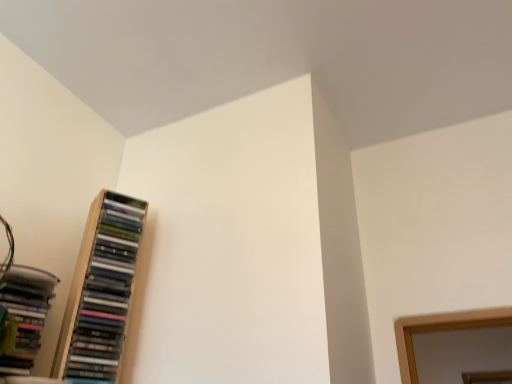
Question: Is wooden bookcase at left to the left or to the right of matte black books at left in the image?

Choices:
 (A) right
 (B) left

Answer: (A)

Question: Considering the positions of wooden bookcase at left and matte black books at left in the image, is wooden bookcase at left wider or thinner than matte black books at left?

Choices:
 (A) thin
 (B) wide

Answer: (A)

Question: Relative to matte black books at left, is wooden bookcase at left in front or behind?

Choices:
 (A) front
 (B) behind

Answer: (B)

Question: Is matte black books at left bigger or smaller than wooden bookcase at left?

Choices:
 (A) small
 (B) big

Answer: (A)

Question: Which is correct: matte black books at left is inside wooden bookcase at left, or outside of it?

Choices:
 (A) inside
 (B) outside

Answer: (B)

Question: From the image's perspective, is matte black books at left above or below wooden bookcase at left?

Choices:
 (A) above
 (B) below

Answer: (B)

Question: Based on their positions, is matte black books at left located to the left or right of wooden bookcase at left?

Choices:
 (A) left
 (B) right

Answer: (A)